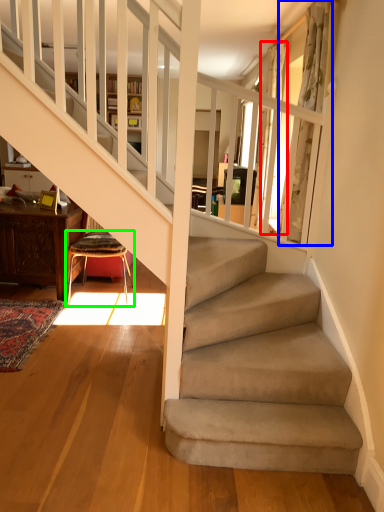
Question: Which object is positioned farthest from curtain (highlighted by a red box)? Select from curtain (highlighted by a blue box) and chair (highlighted by a green box).

Choices:
 (A) curtain
 (B) chair

Answer: (B)